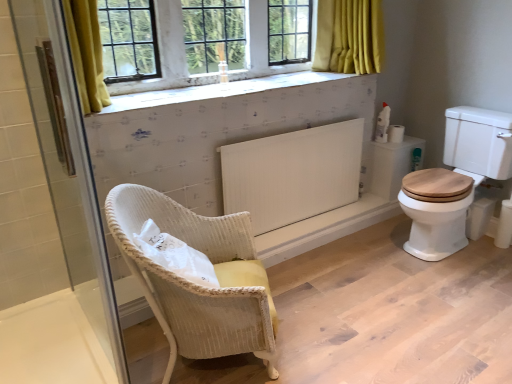
Question: Can you confirm if white matte toilet paper at right is wider than transparent glass shower door at left?

Choices:
 (A) no
 (B) yes

Answer: (B)

Question: Is white matte toilet paper at right at the right side of transparent glass shower door at left?

Choices:
 (A) yes
 (B) no

Answer: (A)

Question: Considering the relative sizes of white matte toilet paper at right and transparent glass shower door at left in the image provided, is white matte toilet paper at right bigger than transparent glass shower door at left?

Choices:
 (A) yes
 (B) no

Answer: (B)

Question: Is white matte toilet paper at right positioned beyond the bounds of transparent glass shower door at left?

Choices:
 (A) yes
 (B) no

Answer: (A)

Question: Does white matte toilet paper at right appear on the left side of transparent glass shower door at left?

Choices:
 (A) no
 (B) yes

Answer: (A)

Question: Considering the positions of white matte toilet paper at right and white matte radiator at center in the image, is white matte toilet paper at right bigger or smaller than white matte radiator at center?

Choices:
 (A) small
 (B) big

Answer: (A)

Question: Considering the positions of point [x=395, y=132] and point [x=230, y=158], is point [x=395, y=132] closer or farther from the camera than point [x=230, y=158]?

Choices:
 (A) farther
 (B) closer

Answer: (A)

Question: Based on their positions, is white matte toilet paper at right located to the left or right of white matte radiator at center?

Choices:
 (A) right
 (B) left

Answer: (A)

Question: Relative to white matte radiator at center, is white matte toilet paper at right in front or behind?

Choices:
 (A) behind
 (B) front

Answer: (A)

Question: Is white textured tile at upper center situated inside white plastic spray bottle at upper right or outside?

Choices:
 (A) outside
 (B) inside

Answer: (A)

Question: Does point (187, 94) appear closer or farther from the camera than point (385, 115)?

Choices:
 (A) closer
 (B) farther

Answer: (A)

Question: From a real-world perspective, is white textured tile at upper center physically located above or below white plastic spray bottle at upper right?

Choices:
 (A) above
 (B) below

Answer: (A)

Question: In the image, is white textured tile at upper center positioned in front of or behind white plastic spray bottle at upper right?

Choices:
 (A) front
 (B) behind

Answer: (A)

Question: Do you think transparent glass shower door at left is within woven yellow chair at center, or outside of it?

Choices:
 (A) outside
 (B) inside

Answer: (A)

Question: Based on their sizes in the image, would you say transparent glass shower door at left is bigger or smaller than woven yellow chair at center?

Choices:
 (A) small
 (B) big

Answer: (A)